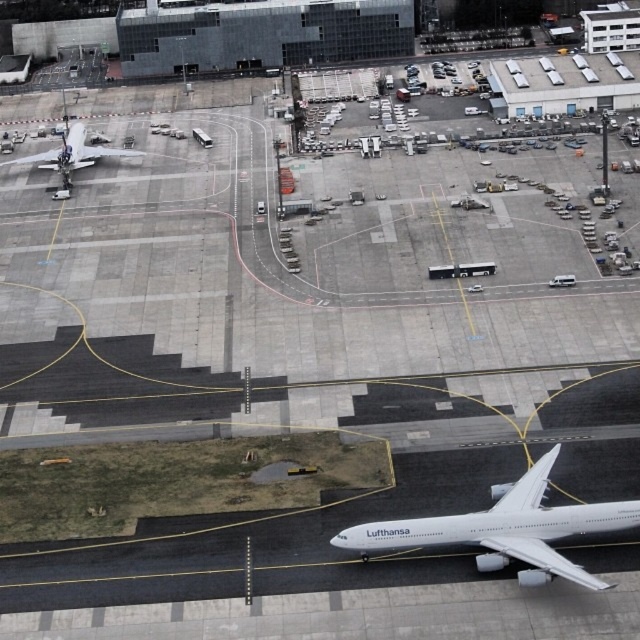
You are a pilot preparing for takeoff and need to ensure there are no obstructions ahead. From your cockpit window, which object would appear smaller in size between the dark gray glass building at upper center and the white glossy airplane at upper left?

The dark gray glass building at upper center has a lesser height compared to the white glossy airplane at upper left, so it would appear smaller in size from the cockpit window.

In the scene shown: You are standing at point (516,515) and want to walk to the Lufthansa aircraft. Is the point (314,52) between you and the aircraft?

Point (314,52) is behind point (516,515), so it is not between you and the aircraft. The aircraft is in front of you.

You are a pilot in an airplane on the tarmac. You need to navigate to the dark gray glass building at upper center. Based on your current position, which direction should you head to reach it?

The dark gray glass building at upper center is located at point (x=260, y=35), so you should head towards that coordinate to reach it.